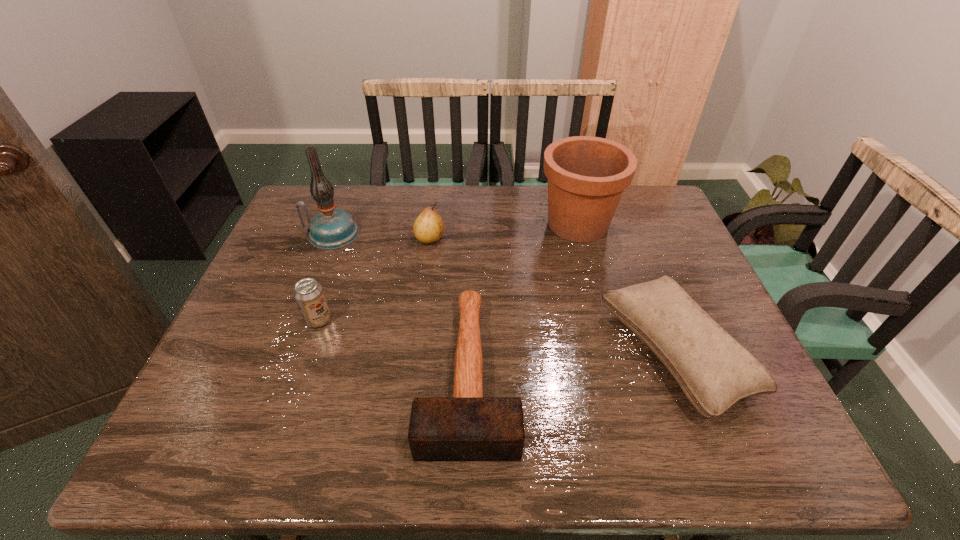
Identify the location of vacant area situated on the back of the cushion. (627, 233).

Where is `oil lamp at the far edge`? The width and height of the screenshot is (960, 540). oil lamp at the far edge is located at coordinates (331, 228).

The image size is (960, 540). I want to click on flowerpot at the far edge, so click(587, 175).

Find the location of `cushion that is at the near edge`. cushion that is at the near edge is located at coordinates (714, 371).

This screenshot has width=960, height=540. What are the coordinates of `mallet that is at the near edge` in the screenshot? It's located at (466, 427).

Identify the location of object positioned at the left edge. This screenshot has height=540, width=960. (331, 228).

You are a GUI agent. You are given a task and a screenshot of the screen. Output one action in this format:
    pyautogui.click(x=<x>, y=<y>)
    Task: Click on the object located in the right edge section of the desktop
    This screenshot has height=540, width=960.
    Given the screenshot: What is the action you would take?
    coord(714,371)

This screenshot has height=540, width=960. Identify the location of object that is at the far left corner. (331, 228).

At what (x,y) coordinates should I click in order to perform the action: click on object that is at the near right corner. Please return your answer as a coordinate pair (x, y). This screenshot has width=960, height=540. Looking at the image, I should click on (714, 371).

The image size is (960, 540). Identify the location of free location at the far edge of the desktop. (547, 185).